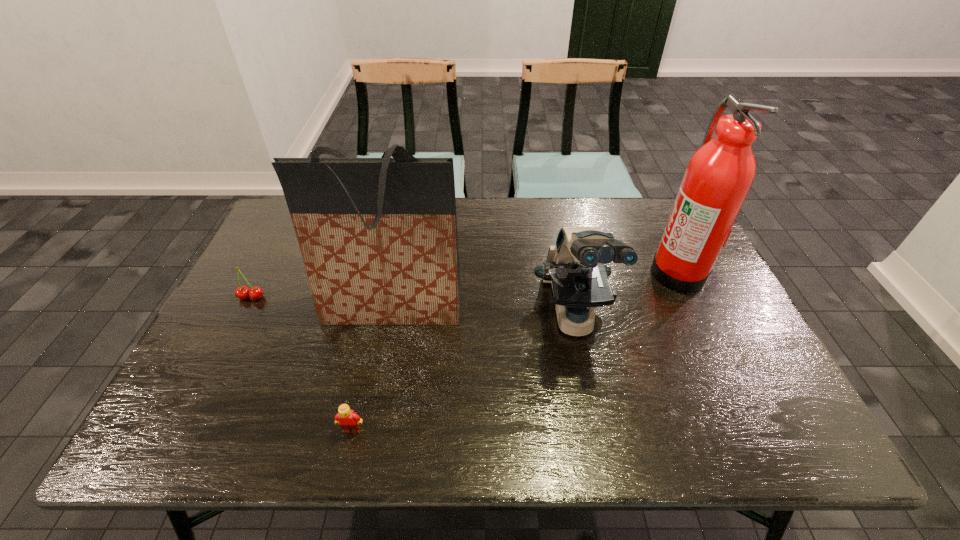
Where is `the rightmost object`? the rightmost object is located at coordinates (719, 175).

Where is `shopping bag`? This screenshot has height=540, width=960. shopping bag is located at coordinates (378, 236).

You are a GUI agent. You are given a task and a screenshot of the screen. Output one action in this format:
    pyautogui.click(x=<x>, y=<y>)
    Task: Click on the fourth object from left to right
    This screenshot has height=540, width=960.
    Given the screenshot: What is the action you would take?
    pyautogui.click(x=575, y=266)

The width and height of the screenshot is (960, 540). Find the location of `microscope`. microscope is located at coordinates (575, 266).

Where is `cherry`? The image size is (960, 540). cherry is located at coordinates (255, 293).

This screenshot has height=540, width=960. What are the coordinates of `Lego` in the screenshot? It's located at (349, 421).

This screenshot has width=960, height=540. I want to click on vacant space positioned 0.210m on the label side of the rightmost object, so click(579, 271).

I want to click on free region located on the label side of the rightmost object, so click(630, 271).

Identify the location of blank space located 0.220m on the label side of the rightmost object. The width and height of the screenshot is (960, 540). (575, 271).

Find the location of a particular element. free space located 0.140m on the front-facing side of the shopping bag is located at coordinates point(378,386).